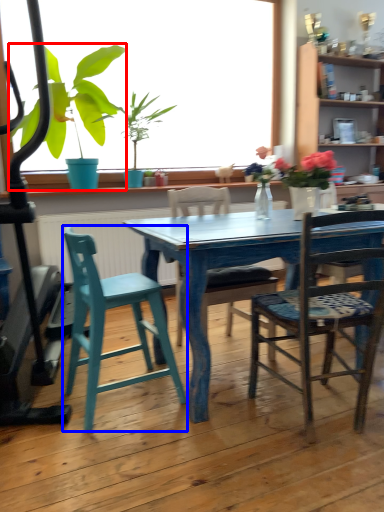
Question: Among these objects, which one is nearest to the camera, houseplant (highlighted by a red box) or chair (highlighted by a blue box)?

Choices:
 (A) houseplant
 (B) chair

Answer: (B)